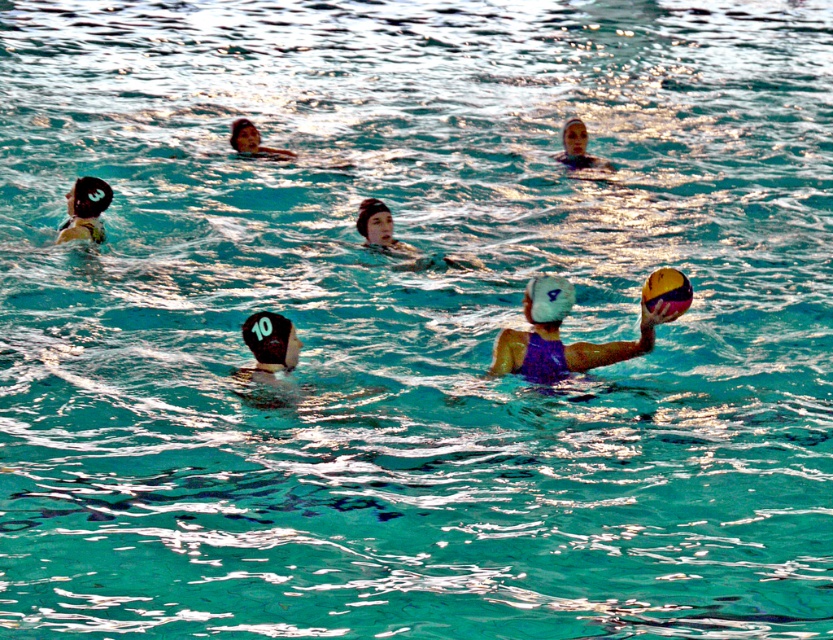
You are a spectator at the water polo match. You notice two swim caps in the scene. Which swim cap, the matte black swim cap at center or the yellow rubber swim cap at upper right, is positioned higher in the image?

The matte black swim cap at center is taller than the yellow rubber swim cap at upper right, so the matte black swim cap at center is positioned higher in the image.

In the water polo scene, there is a matte black swim cap at center and a yellow rubber swim cap at upper right. From the perspective of someone standing at the poolside looking into the water, which swim cap is positioned to the left of the other?

The matte black swim cap at center is positioned to the left of the yellow rubber swim cap at upper right.

In the scene shown: You are a photographer positioned at the center of the pool deck. You want to take a photo of the matte blue swim cap at upper center. Where should you aim your camera relative to the center of the pool deck?

The matte blue swim cap at upper center is located at point 0.230 on the x axis and 0.694 on the y axis. Since the photographer is at the center of the pool deck, they should aim their camera slightly to the left and upwards to capture the swim cap at those coordinates.